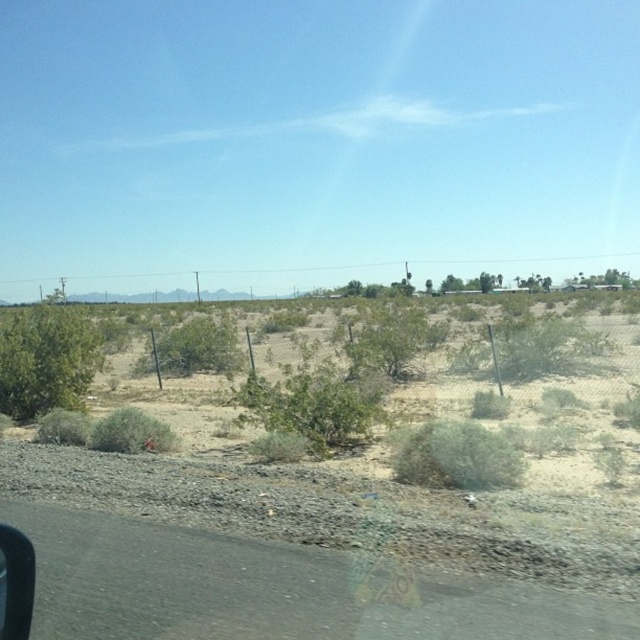
From the picture: Who is higher up, green leafy bush at center or green shrub at center?

green shrub at center is higher up.

Between point (273, 420) and point (177, 352), which one is positioned behind?

Positioned behind is point (177, 352).

Does point (340, 371) lie behind point (225, 371)?

No, it is in front of (225, 371).

Image resolution: width=640 pixels, height=640 pixels. Find the location of `green leafy bush at center`. green leafy bush at center is located at coordinates (316, 403).

Does green leafy bush at center lie behind green fuzzy bush at lower center?

Yes.

Consider the image. Who is shorter, green leafy bush at center or green fuzzy bush at lower center?

With less height is green fuzzy bush at lower center.

Between point (340, 408) and point (426, 483), which one is positioned behind?

The point (340, 408) is more distant.

This screenshot has height=640, width=640. Identify the location of green leafy bush at center. (316, 403).

Between green fuzzy bush at lower center and black rubber car window at lower left, which one is positioned higher?

black rubber car window at lower left is higher up.

Is green fuzzy bush at lower center wider than black rubber car window at lower left?

Indeed, green fuzzy bush at lower center has a greater width compared to black rubber car window at lower left.

Who is more forward, (419, 448) or (16, 625)?

Point (16, 625) is more forward.

Where is `green fuzzy bush at lower center`? The height and width of the screenshot is (640, 640). green fuzzy bush at lower center is located at coordinates [x=458, y=458].